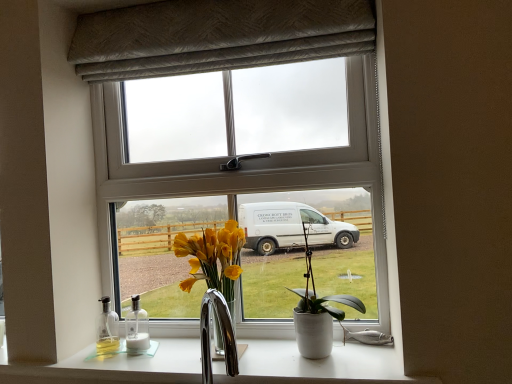
Question: Considering their positions, is white ceramic pot at center located in front of or behind white glossy countertop at lower center?

Choices:
 (A) behind
 (B) front

Answer: (A)

Question: In terms of height, does white ceramic pot at center look taller or shorter compared to white glossy countertop at lower center?

Choices:
 (A) short
 (B) tall

Answer: (B)

Question: Estimate the real-world distances between objects in this image. Which object is farther from the white plastic window at center?

Choices:
 (A) textured gray curtain at upper center
 (B) white glossy countertop at lower center
 (C) white glossy bottle at lower left
 (D) white ceramic pot at center

Answer: (C)

Question: Estimate the real-world distances between objects in this image. Which object is farther from the white glossy countertop at lower center?

Choices:
 (A) white plastic window at center
 (B) textured gray curtain at upper center
 (C) white glossy bottle at lower left
 (D) white ceramic pot at center

Answer: (B)